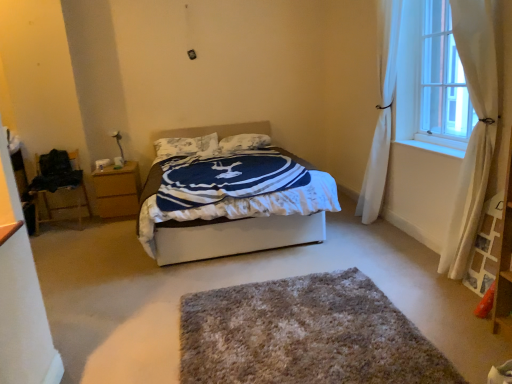
The image size is (512, 384). What are the coordinates of `vacant space underneath white sheer curtain at right, which is the second curtain in back-to-front order (from a real-world perspective)` in the screenshot? It's located at (424, 258).